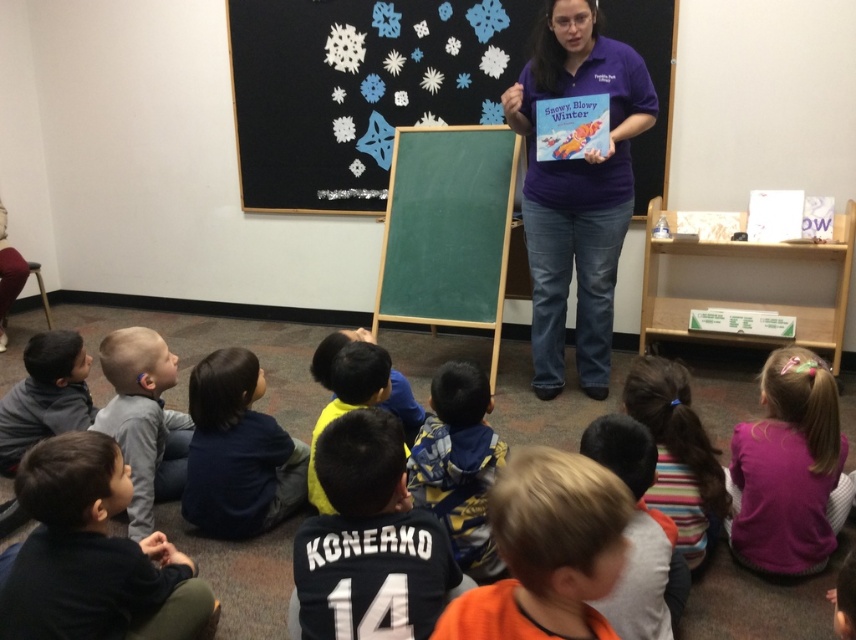
You are a student in the classroom. You notice the paper snowflakes at upper center and the orange fabric shirt at lower center. Which object takes up more space in the image?

The paper snowflakes at upper center takes up more space in the image than the orange fabric shirt at lower center because it is bigger.

You are a teacher in the classroom. You notice the paper snowflakes at upper center and the orange fabric shirt at lower center. Which object is higher up in the image?

The paper snowflakes at upper center are higher up in the image than the orange fabric shirt at lower center because the paper snowflakes at upper center is taller than orange fabric shirt at lower center.